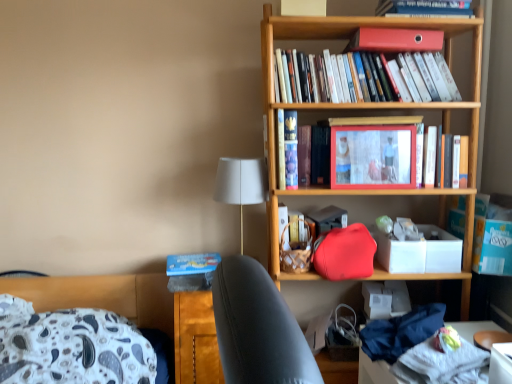
In order to click on free space above white fabric at lower right (from a real-world perspective) in this screenshot , I will do `click(450, 350)`.